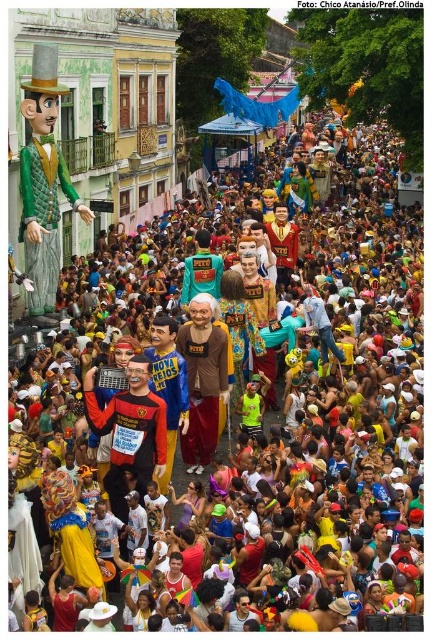
You are a photographer standing at the edge of the crowd in the carnival scene. You want to take a photo that includes both the green quilted fabric at left and the brown matte shirt at center. Considering their distance, will you need to adjust your camera to capture both in focus without moving closer?

The green quilted fabric at left is 16.59 meters away from the brown matte shirt at center. Since the distance between them is significant, you would need to adjust your camera settings to ensure both are in focus, possibly using a smaller aperture for a deeper depth of field.

Consider the image. You are a photographer trying to capture a photo of the brown matte shirt at center without the green quilted fabric at left blocking it. What should you do?

The green quilted fabric at left is taller than the brown matte shirt at center, so you should move to the right side to lower the green quilted fabric at left in the frame or crouch down to avoid its obstruction.

You are a photographer standing in the middle of the street and want to take a photo of both the green quilted fabric at left and the brown matte shirt at center. Which object should you focus on first to ensure both are in the frame?

You should focus on the green quilted fabric at left first because it is closer to you than the brown matte shirt at center, ensuring both are in the frame.